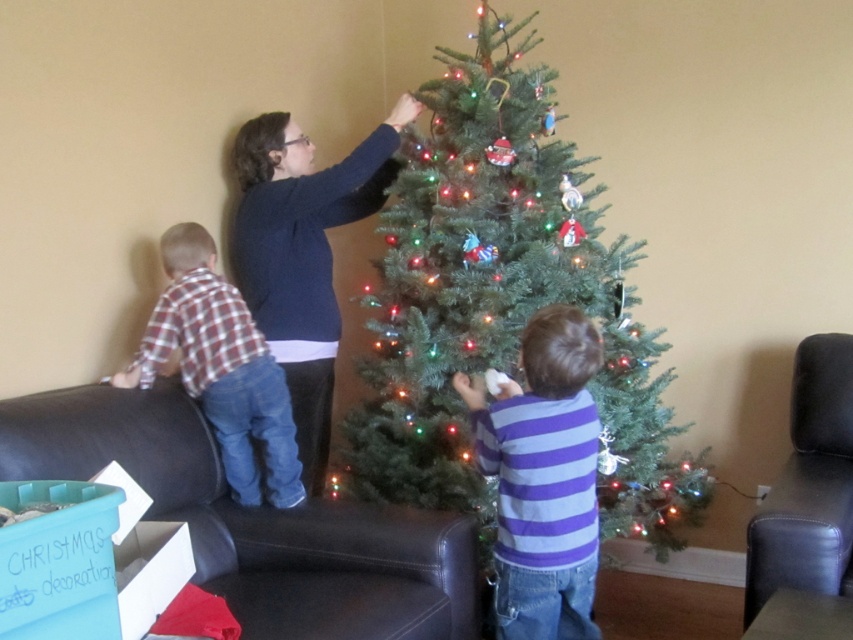
Question: Is green matte christmas tree at center wider than purple striped shirt at center?

Choices:
 (A) no
 (B) yes

Answer: (B)

Question: Which point is closer to the camera?

Choices:
 (A) (585, 540)
 (B) (527, 72)

Answer: (A)

Question: Observing the image, what is the correct spatial positioning of purple striped shirt at center in reference to dark blue sweater at upper center?

Choices:
 (A) left
 (B) right

Answer: (B)

Question: Which point is closer to the camera taking this photo?

Choices:
 (A) (546, 253)
 (B) (498, 476)
 (C) (279, 157)

Answer: (B)

Question: Which point is farther to the camera?

Choices:
 (A) purple striped shirt at center
 (B) plaid fabric shirt at left

Answer: (B)

Question: Can you confirm if dark blue sweater at upper center is bigger than plaid fabric shirt at left?

Choices:
 (A) yes
 (B) no

Answer: (A)